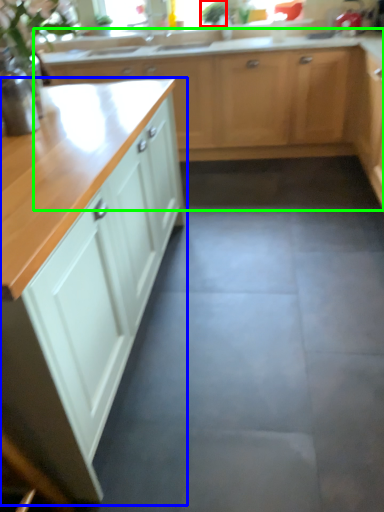
Question: Considering the real-world distances, which object is farthest from plant (highlighted by a red box)? cabinetry (highlighted by a blue box) or cabinetry (highlighted by a green box)?

Choices:
 (A) cabinetry
 (B) cabinetry

Answer: (A)